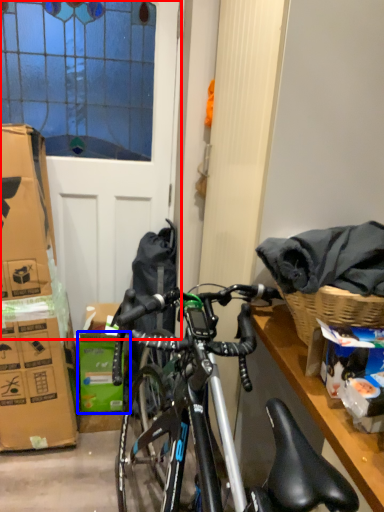
Question: Which object is further to the camera taking this photo, screen door (highlighted by a red box) or box (highlighted by a blue box)?

Choices:
 (A) screen door
 (B) box

Answer: (B)